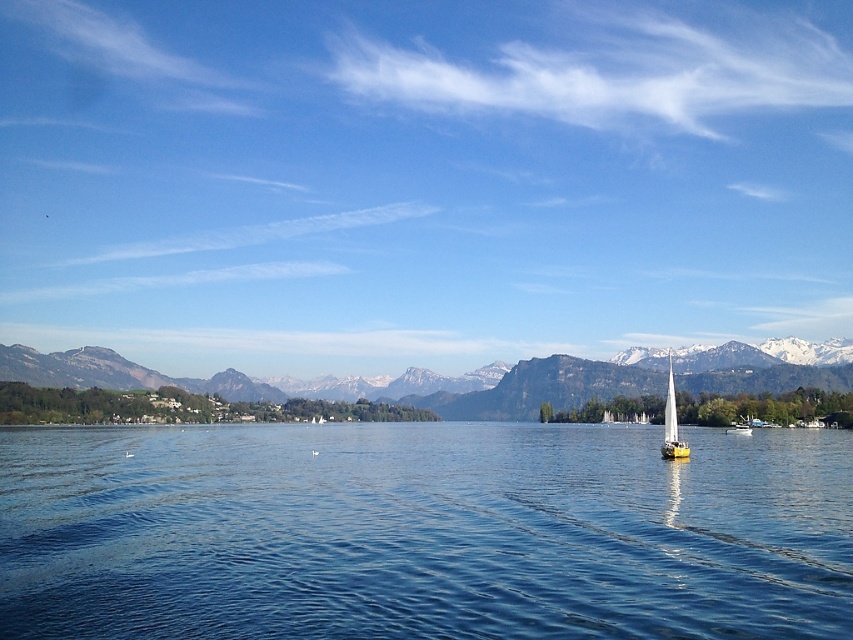
You are a hiker standing on the green grassy mountain at center and want to reach the yellow sailboat at right. Which direction should you head towards?

You should head towards the right direction since the green grassy mountain at center is to the left of yellow sailboat at right, so moving right would lead you towards the boat.

You are standing at the lakeside and want to look up at the sky. Which direction should you tilt your head to see the blue sky at upper center located at point (x=421, y=179)?

The blue sky at upper center is located at point (x=421, y=179), so you should tilt your head upwards to look towards the upper center direction to see it.

You are standing at the point with coordinates (537, 387) in the lakeside scene. What object would you be standing on?

You are standing on the green grassy mountain at center located at point (537, 387).